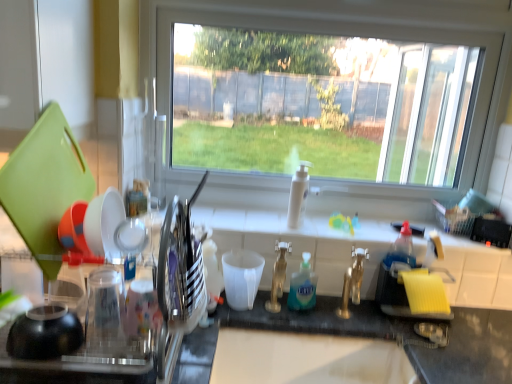
Question: Can you confirm if clear plastic dish rack at left is shorter than blue translucent liquid soap at center?

Choices:
 (A) yes
 (B) no

Answer: (B)

Question: Could you tell me if clear plastic dish rack at left is turned towards blue translucent liquid soap at center?

Choices:
 (A) no
 (B) yes

Answer: (A)

Question: Considering the relative sizes of clear plastic dish rack at left and blue translucent liquid soap at center in the image provided, is clear plastic dish rack at left thinner than blue translucent liquid soap at center?

Choices:
 (A) yes
 (B) no

Answer: (B)

Question: Does clear plastic dish rack at left have a greater width compared to blue translucent liquid soap at center?

Choices:
 (A) yes
 (B) no

Answer: (A)

Question: From the image's perspective, would you say clear plastic dish rack at left is positioned over blue translucent liquid soap at center?

Choices:
 (A) no
 (B) yes

Answer: (B)

Question: Is clear plastic dish rack at left to the right of blue translucent liquid soap at center from the viewer's perspective?

Choices:
 (A) yes
 (B) no

Answer: (B)

Question: Is gold metallic faucet at center far from shiny silver utensil holder at left, the second tableware viewed from the left?

Choices:
 (A) yes
 (B) no

Answer: (B)

Question: From a real-world perspective, is gold metallic faucet at center positioned under shiny silver utensil holder at left, the second tableware viewed from the left, based on gravity?

Choices:
 (A) yes
 (B) no

Answer: (A)

Question: Does gold metallic faucet at center come behind shiny silver utensil holder at left, the second tableware viewed from the left?

Choices:
 (A) yes
 (B) no

Answer: (A)

Question: Does gold metallic faucet at center lie in front of shiny silver utensil holder at left, the second tableware viewed from the left?

Choices:
 (A) no
 (B) yes

Answer: (A)

Question: Is gold metallic faucet at center positioned with its back to shiny silver utensil holder at left, the second tableware when ordered from right to left?

Choices:
 (A) yes
 (B) no

Answer: (B)

Question: Can you confirm if gold metallic faucet at center is smaller than shiny silver utensil holder at left, the second tableware when ordered from right to left?

Choices:
 (A) no
 (B) yes

Answer: (B)

Question: Does clear plastic dish rack at left have a lesser height compared to shiny silver utensil holder at left, the second tableware when ordered from right to left?

Choices:
 (A) no
 (B) yes

Answer: (A)